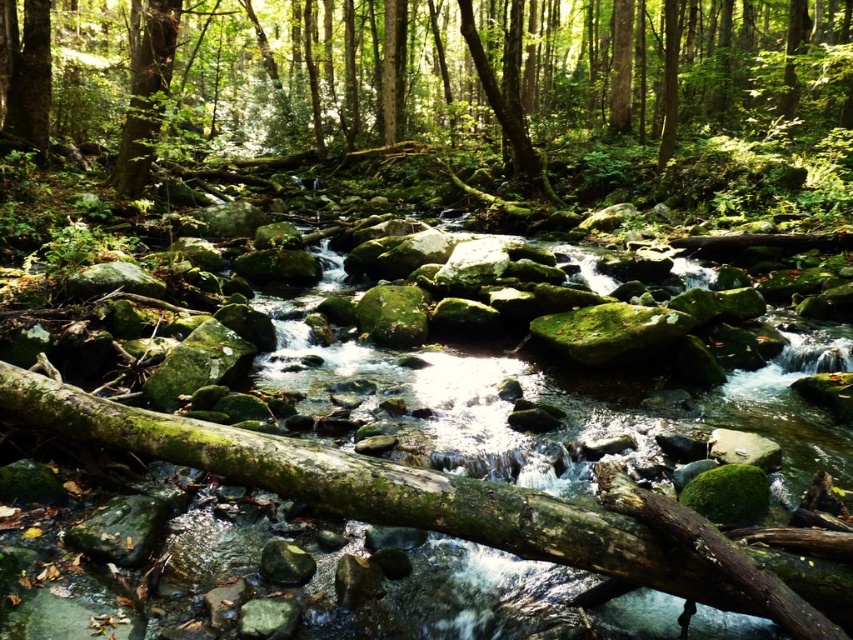
You are a hiker trying to cross the stream in the forest. You notice two rocks in the center of the stream. One is labeled as the green mossy rock at center and the other is labeled as green mossy rocks at center. Which rock should you step on to avoid slipping, considering their height?

The green mossy rock at center has a greater height compared to green mossy rocks at center, so stepping on the taller one would provide a more stable footing and reduce the risk of slipping.

Based on the photo, you are a hiker trying to cross the stream in the forest. You notice two landmarks in the stream to guide your path. The first is a green mossy rock at center, and the second is a group of green mossy rocks at center. Which landmark should you aim for first to cross the stream safely?

You should aim for the green mossy rock at center first because it is positioned to the left of the green mossy rocks at center, making it closer to your starting point on the left side of the stream.

You are a hiker trying to cross the stream in the forest. You notice two rocks in the stream that could help you cross. The first is a green mossy rock at center, and the second is green mossy rocks at center. Which rock would be better to step on for stability?

The green mossy rock at center is larger than the green mossy rocks at center, so stepping on it would provide better stability due to its larger size.